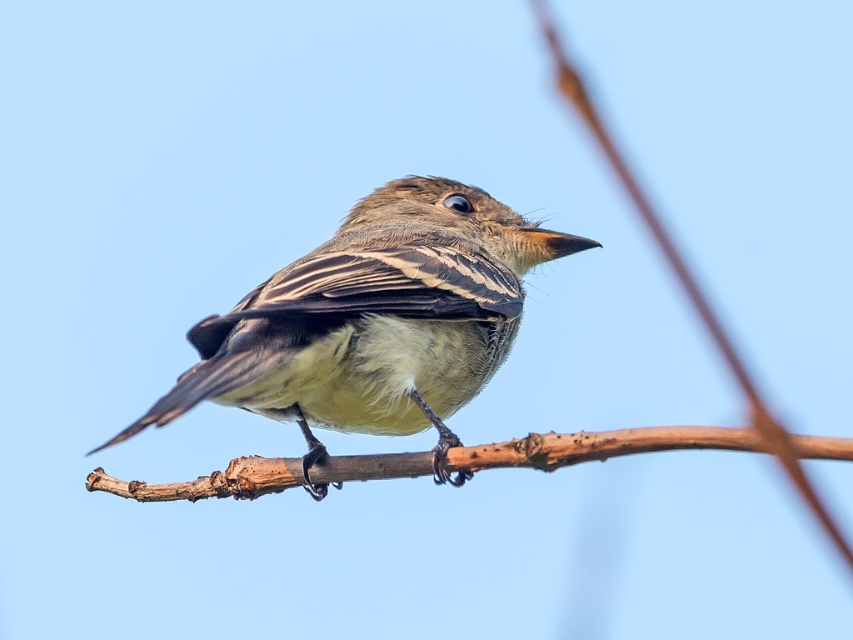
Who is shorter, brown feathered bird at center or brown rough branch at center?

Standing shorter between the two is brown rough branch at center.

Is brown feathered bird at center thinner than brown rough branch at center?

Yes, brown feathered bird at center is thinner than brown rough branch at center.

In order to click on brown feathered bird at center in this screenshot , I will do `click(374, 321)`.